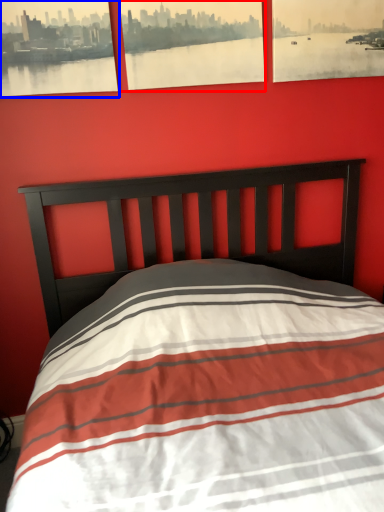
Question: Which object is closer to the camera taking this photo, picture frame (highlighted by a red box) or picture frame (highlighted by a blue box)?

Choices:
 (A) picture frame
 (B) picture frame

Answer: (B)